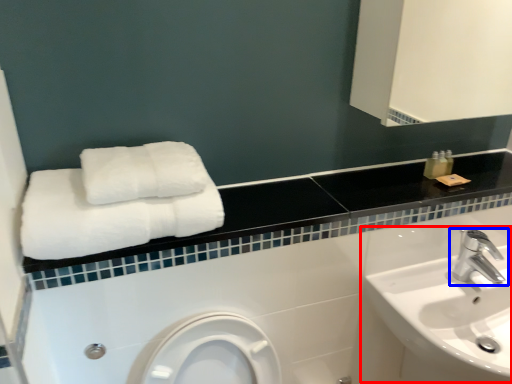
Question: Which object is closer to the camera taking this photo, sink (highlighted by a red box) or tap (highlighted by a blue box)?

Choices:
 (A) sink
 (B) tap

Answer: (A)